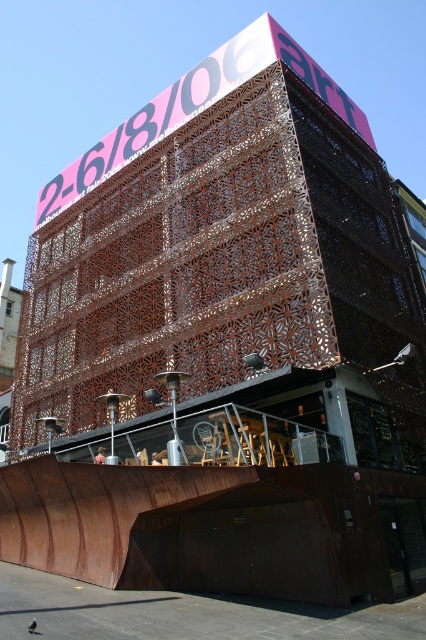
You are standing at the entrance of the modern architectural structure and see the rusty metal ramp at lower center and the metallic skateboard at center. Which object is closer to the right side of the entrance?

The rusty metal ramp at lower center is positioned on the right side of the metallic skateboard at center, so it is closer to the right side of the entrance.

You are a skateboarder at the scene and want to perform a trick on the metallic skateboard at center. Considering the size of the rusty metal ramp at lower center, do you think it would be stable enough to land on after the trick?

The rusty metal ramp at lower center is larger in size than the metallic skateboard at center, so yes, it would provide a stable landing surface after performing the trick.

Looking at this image, you are standing at the entrance of the building and want to locate the rusty metal ramp at lower center. According to the coordinates provided, where exactly should you look to find it?

The rusty metal ramp at lower center is located at point coordinates of 0.800 on the x axis and 0.211 on the y axis.